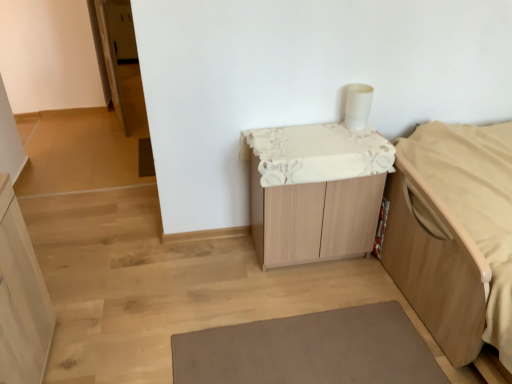
Question: Is light wood cabinet at left aimed at light wood bed frame at right?

Choices:
 (A) yes
 (B) no

Answer: (A)

Question: From a real-world perspective, is light wood cabinet at left positioned under light wood bed frame at right based on gravity?

Choices:
 (A) no
 (B) yes

Answer: (A)

Question: From the image's perspective, would you say light wood cabinet at left is shown under light wood bed frame at right?

Choices:
 (A) no
 (B) yes

Answer: (B)

Question: Does light wood cabinet at left have a greater height compared to light wood bed frame at right?

Choices:
 (A) no
 (B) yes

Answer: (B)

Question: Is light wood cabinet at left to the right of light wood bed frame at right from the viewer's perspective?

Choices:
 (A) no
 (B) yes

Answer: (A)

Question: From a real-world perspective, is gray matte bath mat at lower center physically located above or below light wood cabinet at left?

Choices:
 (A) below
 (B) above

Answer: (A)

Question: Relative to light wood cabinet at left, is gray matte bath mat at lower center in front or behind?

Choices:
 (A) behind
 (B) front

Answer: (A)

Question: Looking at their shapes, would you say gray matte bath mat at lower center is wider or thinner than light wood cabinet at left?

Choices:
 (A) thin
 (B) wide

Answer: (B)

Question: Is gray matte bath mat at lower center inside or outside of light wood cabinet at left?

Choices:
 (A) outside
 (B) inside

Answer: (A)

Question: Is gray matte bath mat at lower center taller or shorter than light wood bed frame at right?

Choices:
 (A) tall
 (B) short

Answer: (B)

Question: From a real-world perspective, is gray matte bath mat at lower center physically located above or below light wood bed frame at right?

Choices:
 (A) below
 (B) above

Answer: (A)

Question: In terms of size, does gray matte bath mat at lower center appear bigger or smaller than light wood bed frame at right?

Choices:
 (A) big
 (B) small

Answer: (B)

Question: Relative to light wood bed frame at right, is gray matte bath mat at lower center in front or behind?

Choices:
 (A) behind
 (B) front

Answer: (A)

Question: Looking at the image, does wooden cabinet at center seem bigger or smaller compared to gray matte bath mat at lower center?

Choices:
 (A) small
 (B) big

Answer: (B)

Question: From the image's perspective, is wooden cabinet at center located above or below gray matte bath mat at lower center?

Choices:
 (A) below
 (B) above

Answer: (B)